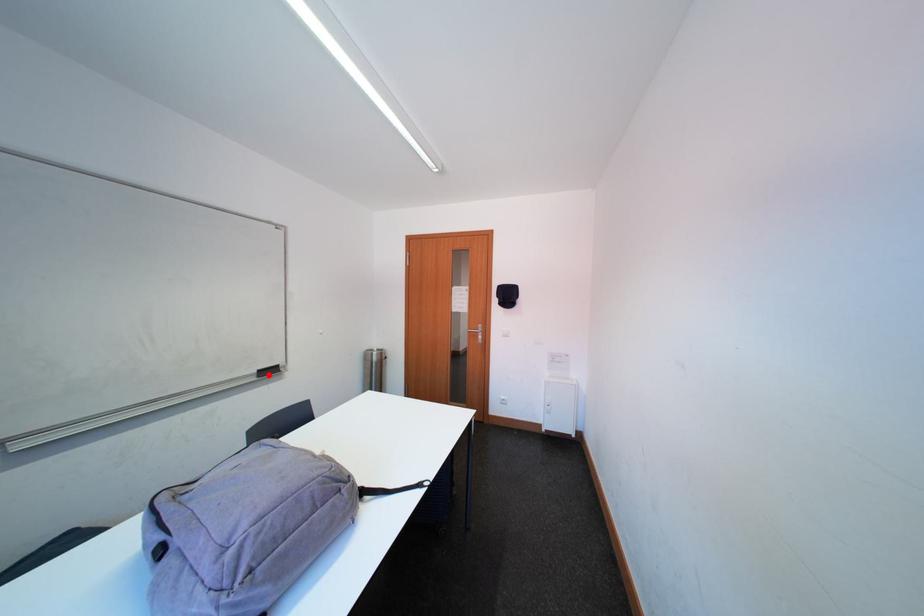
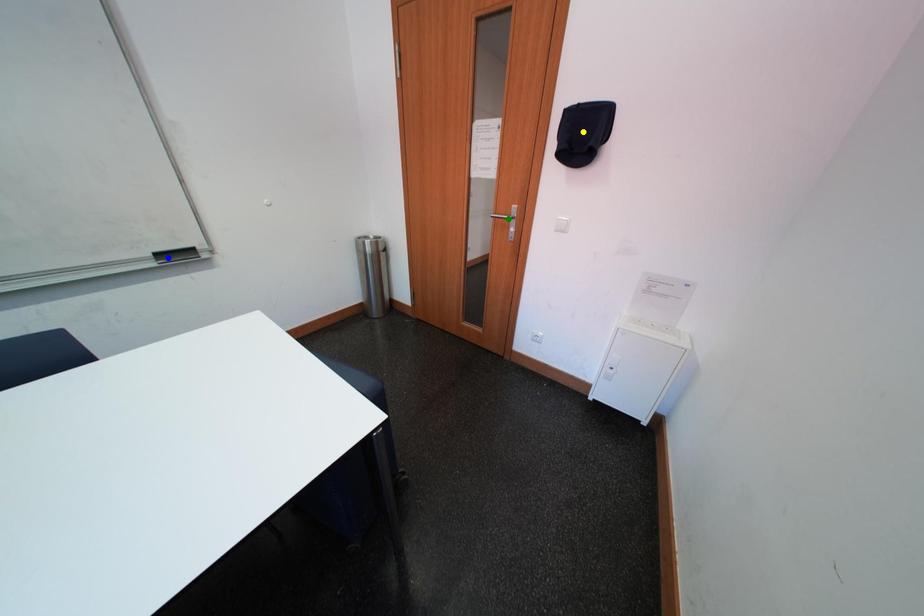
Question: I am providing you with two images of the same scene from different viewpoints. A red point is marked on the first image. You are given multiple points on the second image. Which point in image 2 represents the same 3d spot as the red point in image 1?

Choices:
 (A) blue point
 (B) green point
 (C) yellow point

Answer: (A)